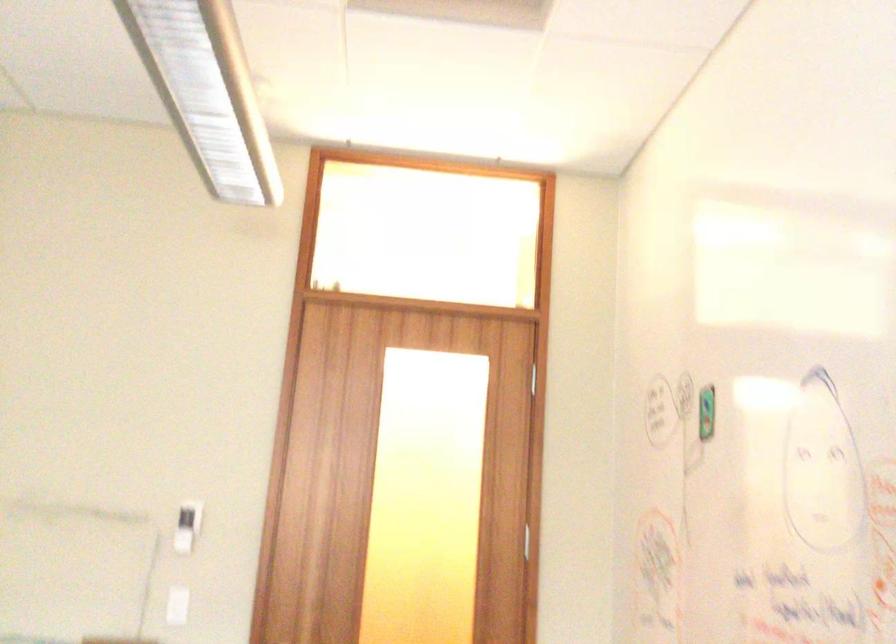
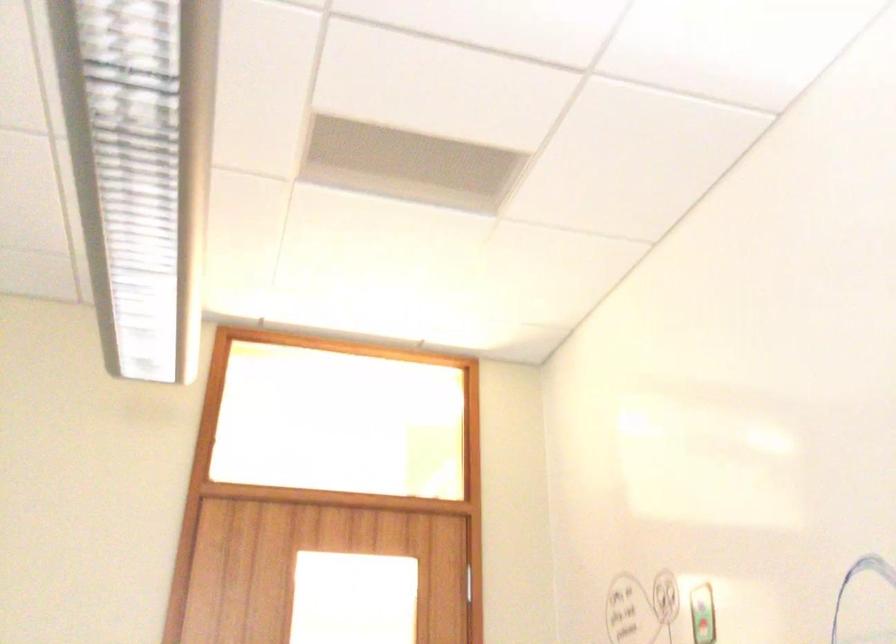
What movement of the cameraman would produce the second image?

The cameraman walked toward left, forward.